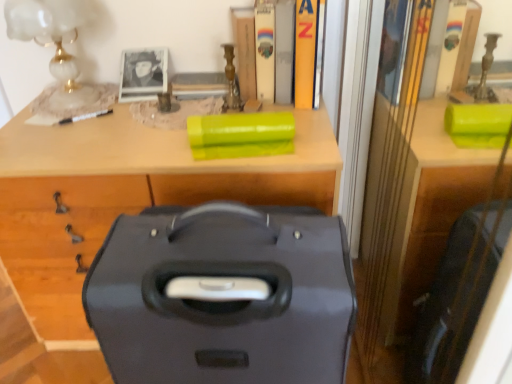
Question: Is hardcover book at upper center, the third book from the left, inside the boundaries of matte black suitcase at center, or outside?

Choices:
 (A) inside
 (B) outside

Answer: (B)

Question: In terms of size, does hardcover book at upper center, which is counted as the second book, starting from the right, appear bigger or smaller than matte black suitcase at center?

Choices:
 (A) small
 (B) big

Answer: (A)

Question: Which is nearer to the wooden book at upper center, which ranks as the fourth book in right-to-left order?

Choices:
 (A) matte black suitcase at center
 (B) matte black suitcase at center
 (C) white marble table lamp at upper left
 (D) hardcover book at upper center, which is counted as the second book, starting from the right
 (E) hardcover book at upper center, which ranks as the 2th book in left-to-right order

Answer: (E)

Question: Considering the real-world distances, which object is closest to the yellow matte book at upper center, the first book viewed from the right?

Choices:
 (A) matte black suitcase at center
 (B) hardcover book at upper center, which ranks as the 2th book in left-to-right order
 (C) white marble table lamp at upper left
 (D) hardcover book at upper center, the third book from the left
 (E) wooden book at upper center, the 1th book positioned from the left

Answer: (D)